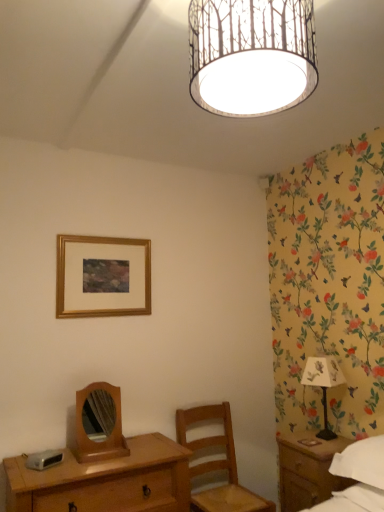
The width and height of the screenshot is (384, 512). In order to click on free spot to the right of wooden mirror at center in this screenshot , I will do `click(139, 454)`.